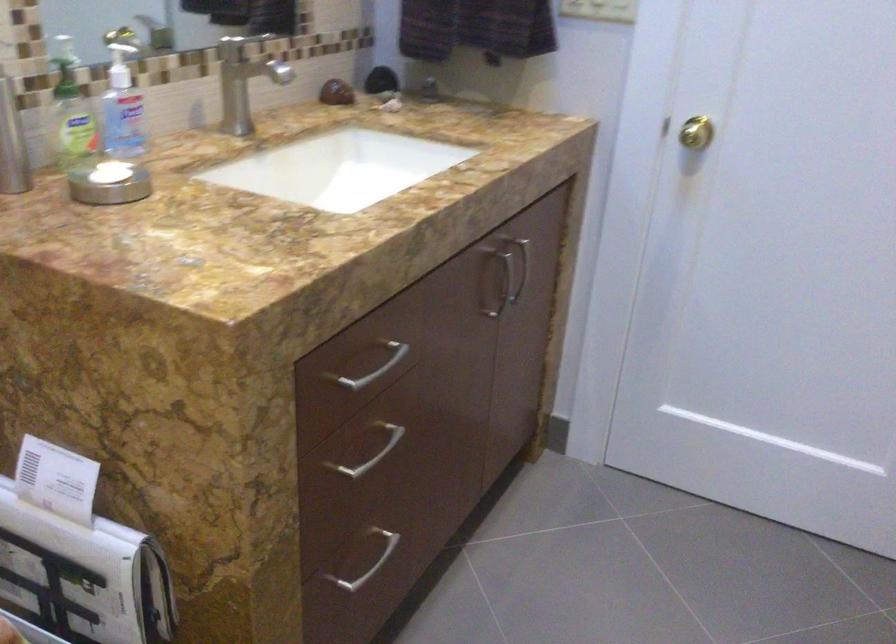
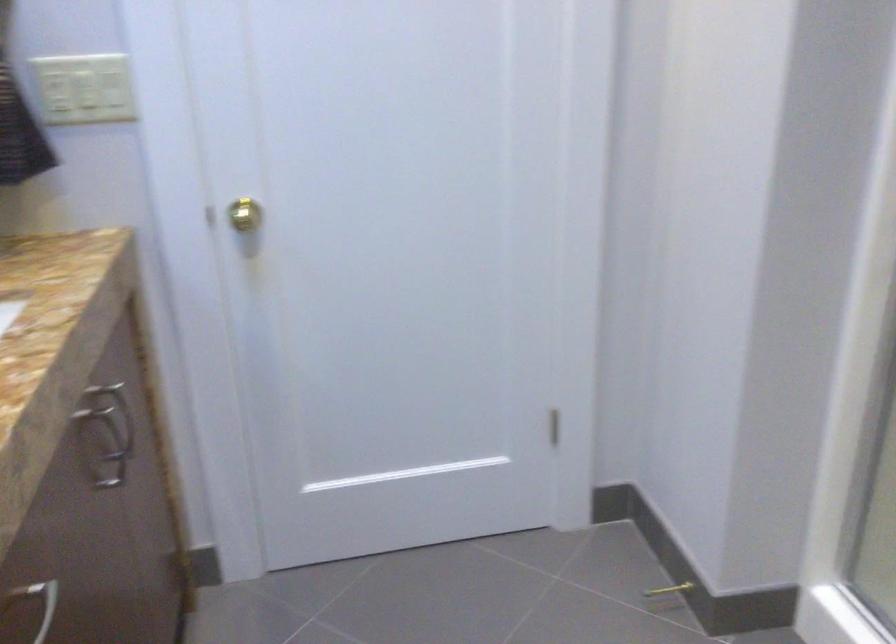
Question: Based on the continuous images, in which direction is the camera rotating? Reply with the corresponding letter.

Choices:
 (A) Left
 (B) Right
 (C) Up
 (D) Down

Answer: (B)